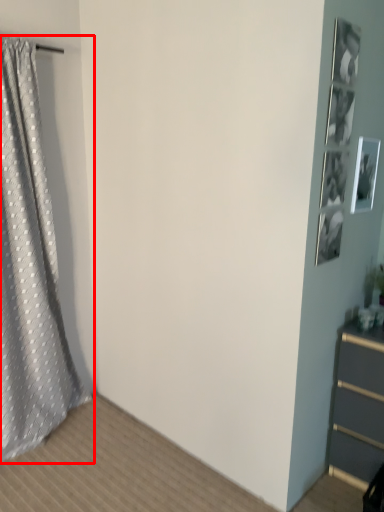
Question: From the image, what is the correct spatial relationship of curtain (annotated by the red box) in relation to picture frame?

Choices:
 (A) right
 (B) left

Answer: (B)